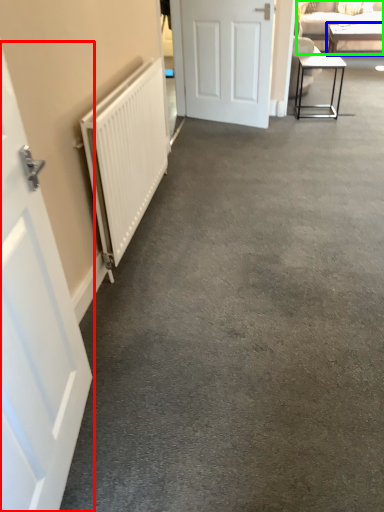
Question: Which object is positioned farthest from door (highlighted by a red box)? Select from table (highlighted by a blue box) and studio couch (highlighted by a green box).

Choices:
 (A) table
 (B) studio couch

Answer: (A)